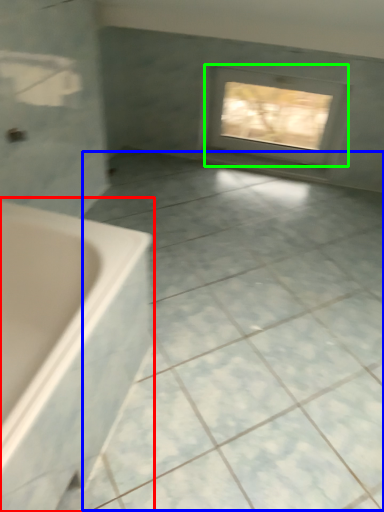
Question: Estimate the real-world distances between objects in this image. Which object is farther from bathtub (highlighted by a red box), ceramic tile (highlighted by a blue box) or window (highlighted by a green box)?

Choices:
 (A) ceramic tile
 (B) window

Answer: (B)